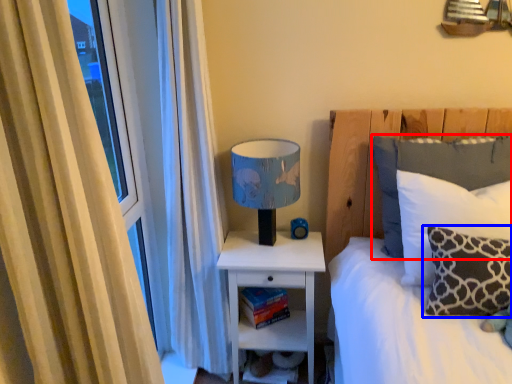
Question: Which object appears closest to the camera in this image, pillow (highlighted by a red box) or pillow (highlighted by a blue box)?

Choices:
 (A) pillow
 (B) pillow

Answer: (B)